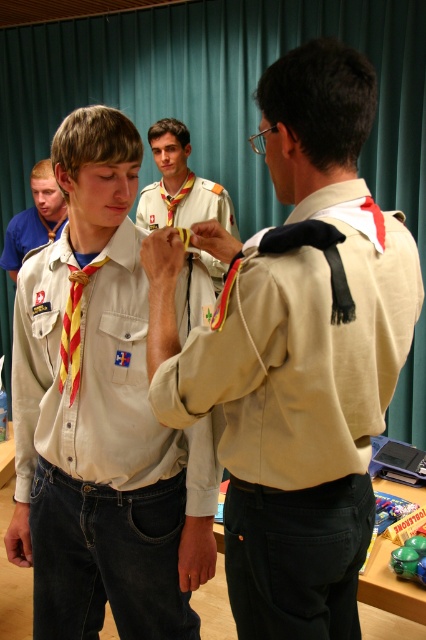
You are a photographer at the event. You need to adjust your camera to focus on both the matte khaki shirt at center and the yellow striped necktie at left. Which object should you focus on first to ensure proper alignment?

The matte khaki shirt at center is located above the yellow striped necktie at left, so you should focus on the matte khaki shirt at center first to ensure proper alignment.